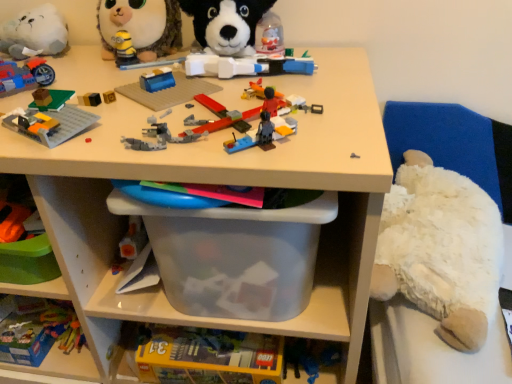
What are the coordinates of `vacant space to the right of white plush dog at upper center, the seventh toy viewed from the left` in the screenshot? It's located at (328, 60).